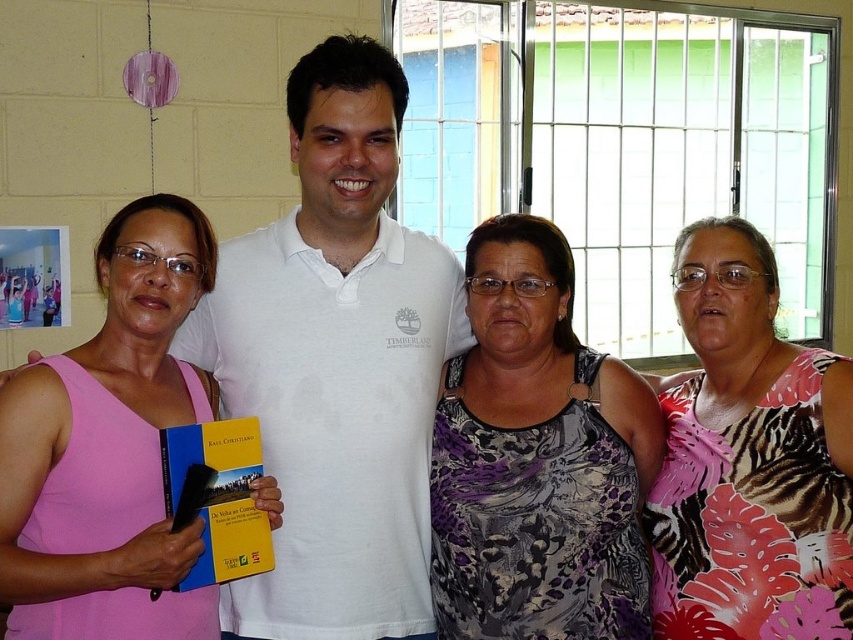
Who is lower down, white cotton shirt at center or pink fabric tank top at left?

pink fabric tank top at left is below.

Is white cotton shirt at center shorter than pink fabric tank top at left?

Incorrect, white cotton shirt at center's height does not fall short of pink fabric tank top at left's.

Does point (300, 250) come behind point (218, 628)?

Yes, it is.

The image size is (853, 640). Find the location of `white cotton shirt at center`. white cotton shirt at center is located at coordinates (335, 355).

Does purple printed tank top at center have a smaller size compared to pink fabric tank top at left?

Yes.

Which is below, purple printed tank top at center or pink fabric tank top at left?

purple printed tank top at center is lower down.

Is point (496, 609) in front of point (50, 480)?

No, it is behind (50, 480).

This screenshot has height=640, width=853. In order to click on purple printed tank top at center in this screenshot , I will do `click(537, 458)`.

Looking at this image, between white cotton shirt at center and purple printed tank top at center, which one has less height?

purple printed tank top at center is shorter.

Is white cotton shirt at center thinner than purple printed tank top at center?

In fact, white cotton shirt at center might be wider than purple printed tank top at center.

Locate an element on the screen. The height and width of the screenshot is (640, 853). white cotton shirt at center is located at coordinates tap(335, 355).

Locate an element on the screen. white cotton shirt at center is located at coordinates (335, 355).